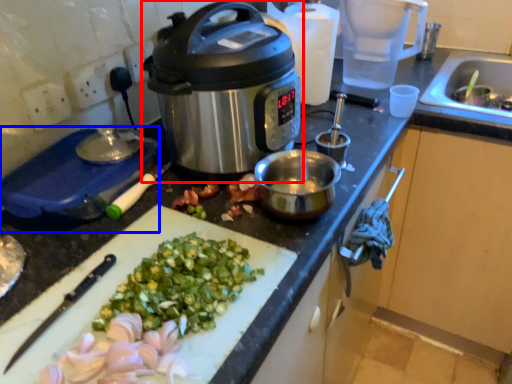
Question: Among these objects, which one is farthest to the camera, slow cooker (highlighted by a red box) or kitchen appliance (highlighted by a blue box)?

Choices:
 (A) slow cooker
 (B) kitchen appliance

Answer: (B)